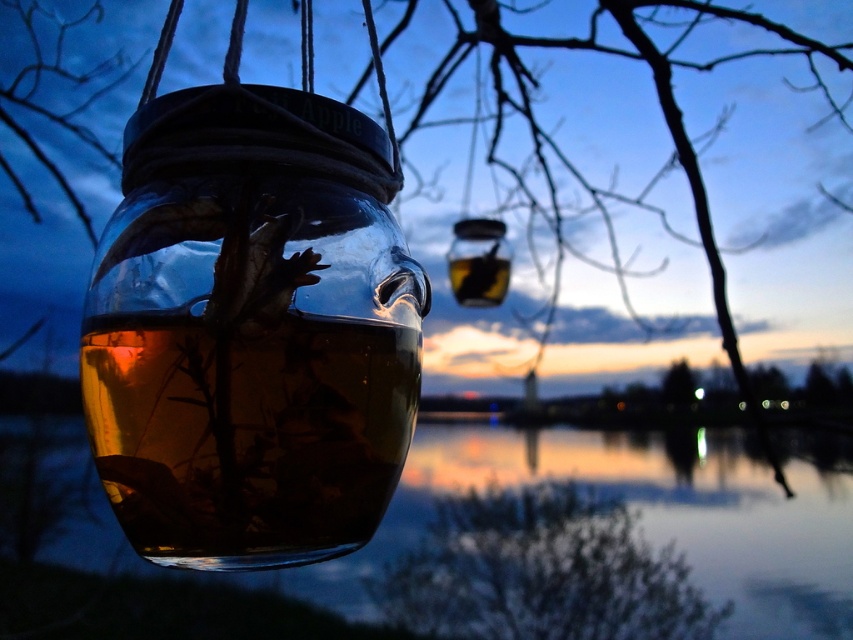
Question: Considering the relative positions of transparent glass jar at center and transparent liquid water at jar left in the image provided, where is transparent glass jar at center located with respect to transparent liquid water at jar left?

Choices:
 (A) above
 (B) below

Answer: (A)

Question: Is transparent glass jar at center behind transparent liquid water at jar left?

Choices:
 (A) no
 (B) yes

Answer: (B)

Question: Which point is closer to the camera?

Choices:
 (A) transparent glass jar at center
 (B) brown textured tree at lower center
 (C) transparent liquid water at jar left

Answer: (C)

Question: Does transparent glass jar at center come behind brown textured tree at lower center?

Choices:
 (A) no
 (B) yes

Answer: (A)

Question: Estimate the real-world distances between objects in this image. Which object is closer to the transparent liquid water at jar left?

Choices:
 (A) transparent glass jar at center
 (B) brown textured tree at lower center

Answer: (B)

Question: Which object is the farthest from the transparent liquid water at jar left?

Choices:
 (A) transparent glass jar at center
 (B) brown textured tree at lower center

Answer: (A)